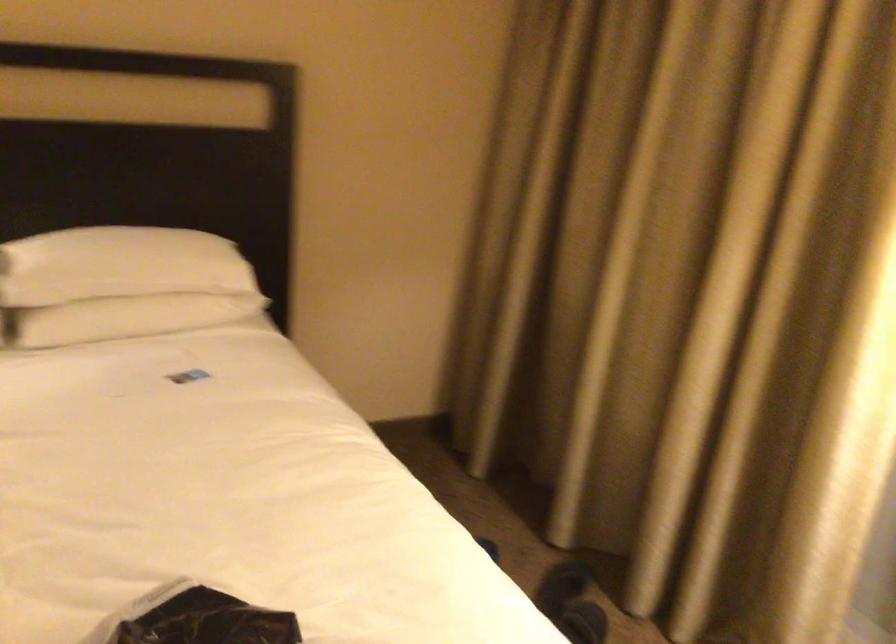
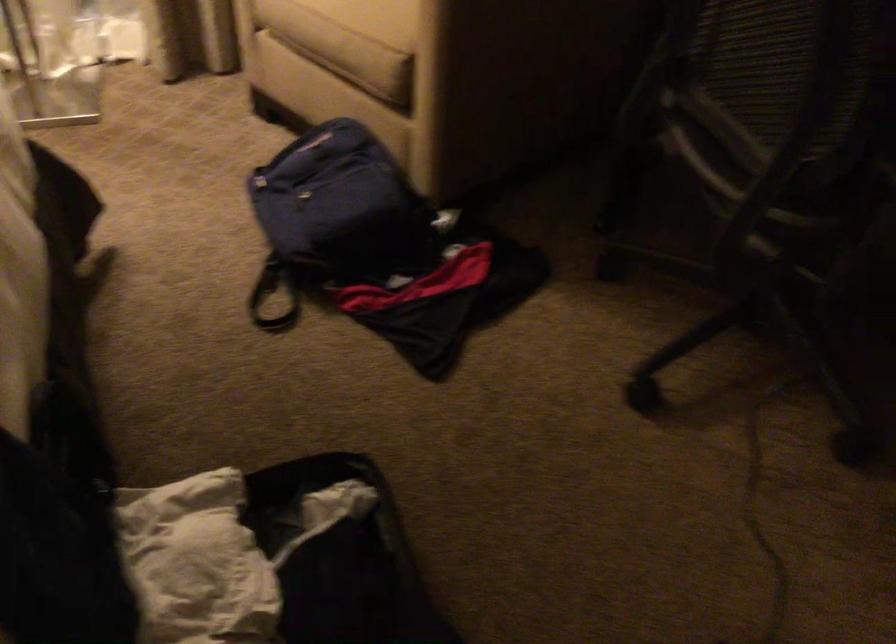
The images are taken continuously from a first-person perspective. In which direction is your viewpoint rotating?

The camera rotated toward right-down.